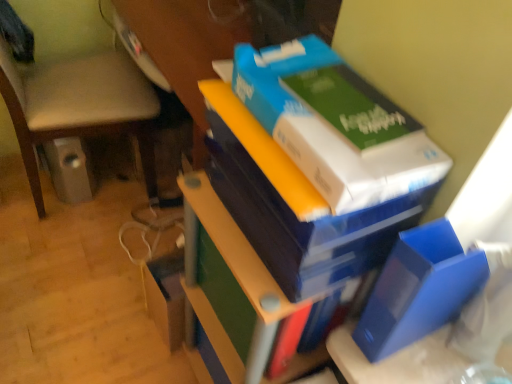
Question: Is the position of blue matte folder at lower right, which appears as the first paperback book when ordered from the bottom, more distant than that of beige fabric chair at lower left?

Choices:
 (A) yes
 (B) no

Answer: (B)

Question: Considering the relative positions of blue matte folder at lower right, the 2th paperback book viewed from the top, and beige fabric chair at lower left in the image provided, is blue matte folder at lower right, the 2th paperback book viewed from the top, to the left of beige fabric chair at lower left from the viewer's perspective?

Choices:
 (A) yes
 (B) no

Answer: (B)

Question: Considering the relative sizes of blue matte folder at lower right, the 2th paperback book viewed from the top, and beige fabric chair at lower left in the image provided, is blue matte folder at lower right, the 2th paperback book viewed from the top, thinner than beige fabric chair at lower left?

Choices:
 (A) yes
 (B) no

Answer: (A)

Question: From the image's perspective, does blue matte folder at lower right, which appears as the first paperback book when ordered from the bottom, appear higher than beige fabric chair at lower left?

Choices:
 (A) yes
 (B) no

Answer: (B)

Question: Considering the relative sizes of blue matte folder at lower right, which appears as the first paperback book when ordered from the bottom, and beige fabric chair at lower left in the image provided, is blue matte folder at lower right, which appears as the first paperback book when ordered from the bottom, taller than beige fabric chair at lower left?

Choices:
 (A) no
 (B) yes

Answer: (A)

Question: From a real-world perspective, relative to white cardboard box at upper right, is beige fabric chair at lower left vertically above or below?

Choices:
 (A) below
 (B) above

Answer: (A)

Question: Is beige fabric chair at lower left in front of or behind white cardboard box at upper right in the image?

Choices:
 (A) front
 (B) behind

Answer: (B)

Question: Considering the positions of beige fabric chair at lower left and white cardboard box at upper right in the image, is beige fabric chair at lower left bigger or smaller than white cardboard box at upper right?

Choices:
 (A) small
 (B) big

Answer: (B)

Question: Is beige fabric chair at lower left to the left or to the right of white cardboard box at upper right in the image?

Choices:
 (A) left
 (B) right

Answer: (A)

Question: Is point (344, 135) closer or farther from the camera than point (92, 112)?

Choices:
 (A) closer
 (B) farther

Answer: (A)

Question: Which is correct: green matte paperback book at upper right, placed as the 2th paperback book when sorted from bottom to top, is inside beige fabric chair at lower left, or outside of it?

Choices:
 (A) inside
 (B) outside

Answer: (B)

Question: Is green matte paperback book at upper right, which is counted as the first paperback book, starting from the top, in front of or behind beige fabric chair at lower left in the image?

Choices:
 (A) behind
 (B) front

Answer: (B)

Question: Considering the relative positions of green matte paperback book at upper right, placed as the 2th paperback book when sorted from bottom to top, and beige fabric chair at lower left in the image provided, is green matte paperback book at upper right, placed as the 2th paperback book when sorted from bottom to top, to the left or to the right of beige fabric chair at lower left?

Choices:
 (A) left
 (B) right

Answer: (B)

Question: From a real-world perspective, is green matte paperback book at upper right, which is counted as the first paperback book, starting from the top, physically located above or below blue cardboard box at upper right?

Choices:
 (A) above
 (B) below

Answer: (A)

Question: Is green matte paperback book at upper right, placed as the 2th paperback book when sorted from bottom to top, taller or shorter than blue cardboard box at upper right?

Choices:
 (A) short
 (B) tall

Answer: (A)